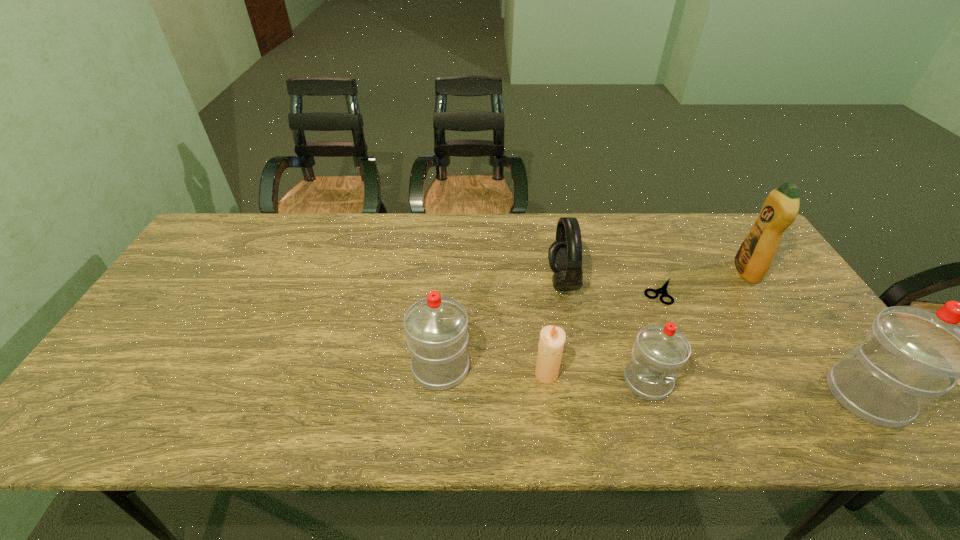
Where is `vacant space at the far edge`? The width and height of the screenshot is (960, 540). vacant space at the far edge is located at coordinates (542, 228).

The width and height of the screenshot is (960, 540). I want to click on vacant space at the near edge of the desktop, so click(x=185, y=392).

At what (x,y) coordinates should I click in order to perform the action: click on vacant area at the left edge of the desktop. Please return your answer as a coordinate pair (x, y). The image size is (960, 540). Looking at the image, I should click on (152, 327).

Where is `vacant space at the right edge of the desktop`? This screenshot has height=540, width=960. vacant space at the right edge of the desktop is located at coordinates (771, 293).

Locate an element on the screen. Image resolution: width=960 pixels, height=540 pixels. vacant area at the far left corner is located at coordinates (200, 254).

Image resolution: width=960 pixels, height=540 pixels. In order to click on vacant region at the far right corner of the desktop in this screenshot , I will do `click(722, 238)`.

You are a GUI agent. You are given a task and a screenshot of the screen. Output one action in this format:
    pyautogui.click(x=<x>, y=<y>)
    Task: Click on the free space between the rightmost water bottle and the shortest water bottle
    This screenshot has width=960, height=540.
    Given the screenshot: What is the action you would take?
    pyautogui.click(x=756, y=389)

Where is `blank region between the leftmost object and the second object from left to right`? The height and width of the screenshot is (540, 960). blank region between the leftmost object and the second object from left to right is located at coordinates (493, 370).

Image resolution: width=960 pixels, height=540 pixels. What are the coordinates of `free space between the shears and the fifth object from right to left` in the screenshot? It's located at (612, 286).

Where is `vacant space that is in between the headset and the fourth object from right to left`? vacant space that is in between the headset and the fourth object from right to left is located at coordinates (605, 331).